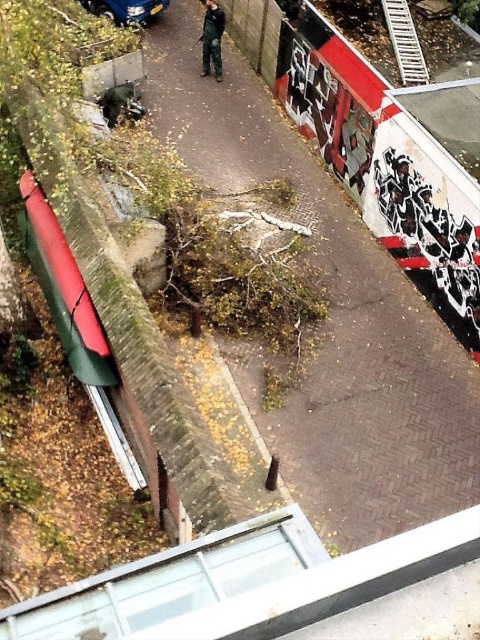
You are standing at the center of the scene and see the metallic blue car at upper left and the dark green camouflage pants at center. Which object is located to the left of the other?

The metallic blue car at upper left is positioned on the left side of dark green camouflage pants at center.

You are a delivery person trying to park your 1.8 meters tall delivery cart between the metallic blue car at upper left and the dark green camouflage pants at center. Can your cart fit vertically between them?

The metallic blue car at upper left is shorter than the dark green camouflage pants at center, so the vertical space between them is determined by the shorter object. Since the car is shorter, the available vertical space is only as tall as the car, which is less than 1.8 meters. Therefore, the delivery cart cannot fit vertically between them.

You are a photographer standing at the edge of the walkway. You want to take a photo of the metallic blue car at upper left without the dark green camouflage pants at center appearing in the shot. Is this possible based on their positions?

The dark green camouflage pants at center is behind the metallic blue car at upper left, so the pants will not be visible in the photo if you position yourself so the car is between you and the pants.